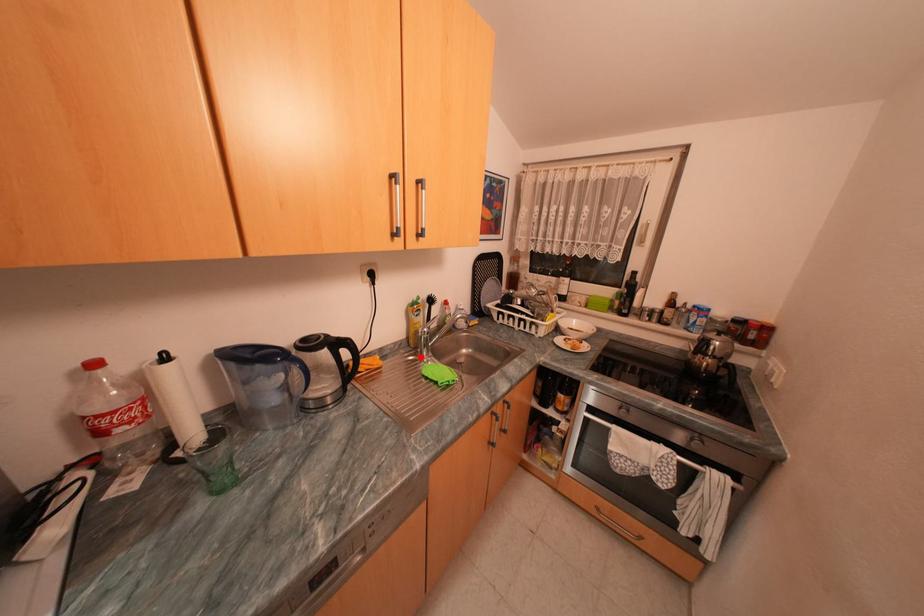
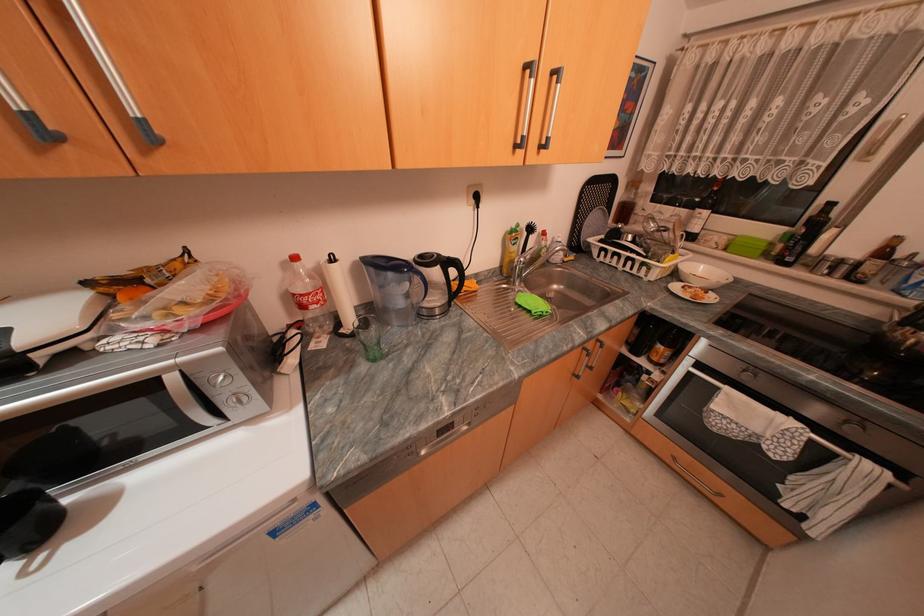
Locate, in the second image, the point that corresponds to the highlighted location in the first image.

(514, 285)